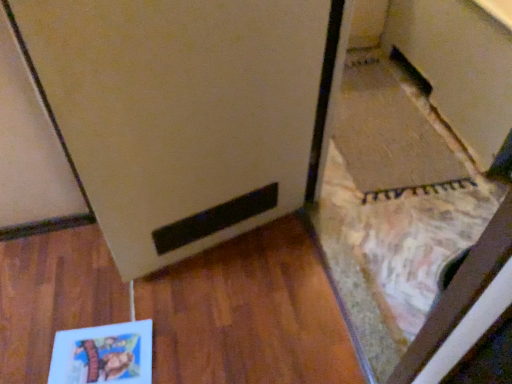
What do you see at coordinates (103, 354) in the screenshot? I see `matte paper book at lower left` at bounding box center [103, 354].

This screenshot has height=384, width=512. In order to click on matte paper book at lower left in this screenshot , I will do `click(103, 354)`.

At what (x,y) coordinates should I click in order to perform the action: click on cabinetry below the matte white fridge at center (from a real-world perspective). Please return your answer as a coordinate pair (x, y). The width and height of the screenshot is (512, 384). Looking at the image, I should click on (458, 67).

From the image's perspective, is matte white fridge at center on top of matte brown cabinet at lower right?

No, from the image's perspective, matte white fridge at center is not over matte brown cabinet at lower right.

From a real-world perspective, which object rests below the other?

In real-world perspective, matte brown cabinet at lower right is lower.

In terms of size, does matte white fridge at center appear bigger or smaller than matte brown cabinet at lower right?

In the image, matte white fridge at center appears to be smaller than matte brown cabinet at lower right.

Consider the image. Does matte paper book at lower left have a greater height compared to matte white fridge at center?

In fact, matte paper book at lower left may be shorter than matte white fridge at center.

Is matte paper book at lower left bigger or smaller than matte white fridge at center?

Clearly, matte paper book at lower left is smaller in size than matte white fridge at center.

In the scene shown: Does matte paper book at lower left touch matte white fridge at center?

No.

Considering the relative positions of matte paper book at lower left and matte white fridge at center in the image provided, is matte paper book at lower left behind matte white fridge at center?

Yes, matte paper book at lower left is behind matte white fridge at center.

Visually, is matte white fridge at center positioned to the left or to the right of matte paper book at lower left?

matte white fridge at center is to the right of matte paper book at lower left.

Could you tell me if matte white fridge at center is facing matte paper book at lower left?

No, matte white fridge at center is not turned towards matte paper book at lower left.

In order to click on fridge above the matte paper book at lower left (from a real-world perspective) in this screenshot , I will do `click(186, 112)`.

Looking at this image, is matte white fridge at center wider or thinner than matte paper book at lower left?

Considering their sizes, matte white fridge at center looks slimmer than matte paper book at lower left.

Measure the distance from matte brown cabinet at lower right to matte white fridge at center.

A distance of 1.08 meters exists between matte brown cabinet at lower right and matte white fridge at center.

Is matte brown cabinet at lower right taller or shorter than matte white fridge at center?

Considering their sizes, matte brown cabinet at lower right has less height than matte white fridge at center.

Does point (421, 67) come closer to viewer compared to point (246, 97)?

That is False.

Considering the sizes of objects matte brown cabinet at lower right and matte white fridge at center in the image provided, who is bigger, matte brown cabinet at lower right or matte white fridge at center?

Bigger between the two is matte brown cabinet at lower right.

Is matte paper book at lower left to the right of matte brown cabinet at lower right from the viewer's perspective?

In fact, matte paper book at lower left is to the left of matte brown cabinet at lower right.

Considering the relative sizes of matte paper book at lower left and matte brown cabinet at lower right in the image provided, is matte paper book at lower left taller than matte brown cabinet at lower right?

No.

How different are the orientations of matte paper book at lower left and matte brown cabinet at lower right in degrees?

They differ by 174 degrees in their facing directions.

Is matte paper book at lower left facing towards matte brown cabinet at lower right?

No, matte paper book at lower left is not aimed at matte brown cabinet at lower right.

In the image, is matte brown cabinet at lower right on the left side or the right side of matte paper book at lower left?

Based on their positions, matte brown cabinet at lower right is located to the right of matte paper book at lower left.

From the image's perspective, which is below, matte brown cabinet at lower right or matte paper book at lower left?

matte paper book at lower left.

Which of these two, matte brown cabinet at lower right or matte paper book at lower left, is bigger?

Bigger between the two is matte brown cabinet at lower right.

Is matte brown cabinet at lower right oriented away from matte paper book at lower left?

matte brown cabinet at lower right is not turned away from matte paper book at lower left.

Identify the location of cabinetry behind the matte white fridge at center. The height and width of the screenshot is (384, 512). (458, 67).

Image resolution: width=512 pixels, height=384 pixels. Find the location of `fridge on the right of matte paper book at lower left`. fridge on the right of matte paper book at lower left is located at coordinates (186, 112).

Estimate the real-world distances between objects in this image. Which object is closer to matte white fridge at center, matte paper book at lower left or matte brown cabinet at lower right?

matte paper book at lower left.

Estimate the real-world distances between objects in this image. Which object is closer to matte brown cabinet at lower right, matte paper book at lower left or matte white fridge at center?

matte white fridge at center lies closer to matte brown cabinet at lower right than the other object.

Based on the photo, looking at the image, which one is located closer to matte paper book at lower left, matte white fridge at center or matte brown cabinet at lower right?

The object closer to matte paper book at lower left is matte white fridge at center.

Estimate the real-world distances between objects in this image. Which object is closer to matte brown cabinet at lower right, matte white fridge at center or matte paper book at lower left?

matte white fridge at center lies closer to matte brown cabinet at lower right than the other object.

Estimate the real-world distances between objects in this image. Which object is closer to matte white fridge at center, matte brown cabinet at lower right or matte paper book at lower left?

Based on the image, matte paper book at lower left appears to be nearer to matte white fridge at center.

From the image, which object appears to be farther from matte paper book at lower left, matte brown cabinet at lower right or matte white fridge at center?

matte brown cabinet at lower right lies further to matte paper book at lower left than the other object.

Locate an element on the screen. Image resolution: width=512 pixels, height=384 pixels. fridge between matte paper book at lower left and matte brown cabinet at lower right from left to right is located at coordinates (186, 112).